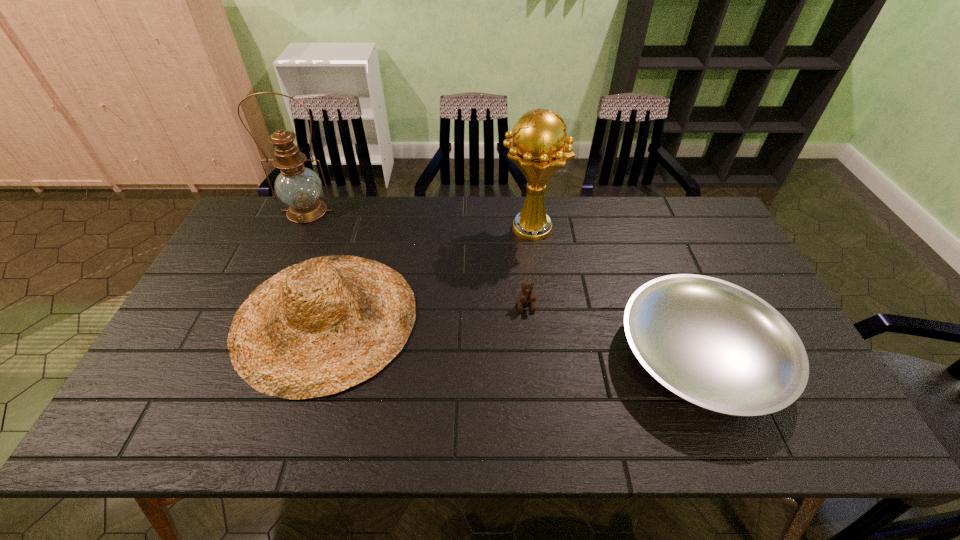
The height and width of the screenshot is (540, 960). In order to click on oil lamp in this screenshot , I will do [x=299, y=187].

At what (x,y) coordinates should I click in order to perform the action: click on trophy_cup. Please return your answer as a coordinate pair (x, y). Looking at the image, I should click on (540, 147).

Where is `the third shortest object`? The width and height of the screenshot is (960, 540). the third shortest object is located at coordinates (316, 328).

In order to click on bedpan in this screenshot , I will do `click(712, 343)`.

The width and height of the screenshot is (960, 540). What are the coordinates of `teddy bear` in the screenshot? It's located at (526, 295).

Find the location of a particular element. vacant space positioned on the right of the oil lamp is located at coordinates (360, 211).

The height and width of the screenshot is (540, 960). Identify the location of free region located at the front of the trophy_cup where the globe is prominent. (469, 228).

In order to click on vacant space situated at the front of the trophy_cup where the globe is prominent in this screenshot , I will do `click(443, 228)`.

Where is `vacant area situated 0.070m at the front of the trophy_cup where the globe is prominent`? vacant area situated 0.070m at the front of the trophy_cup where the globe is prominent is located at coordinates (479, 228).

This screenshot has height=540, width=960. I want to click on vacant region located on the right of the third shortest object, so click(x=512, y=318).